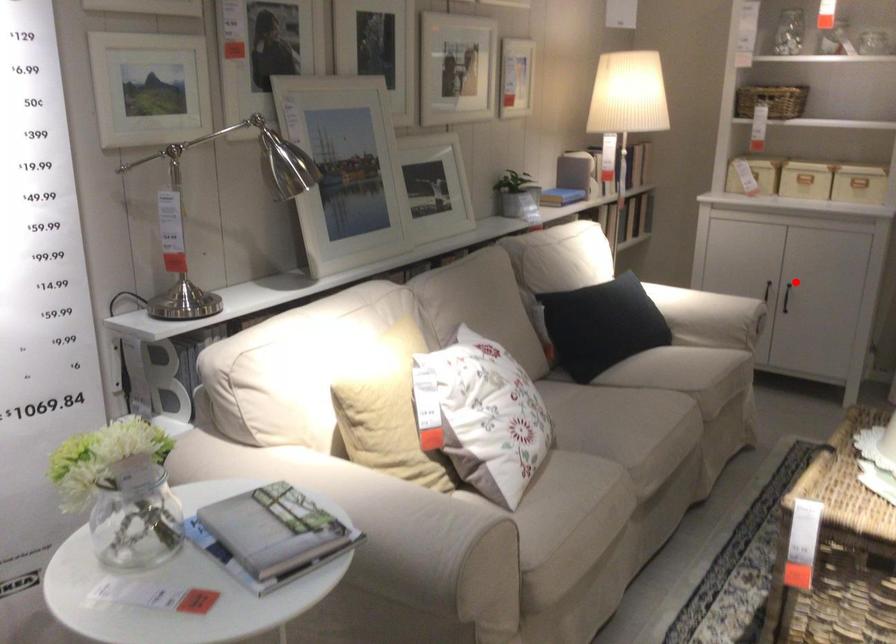
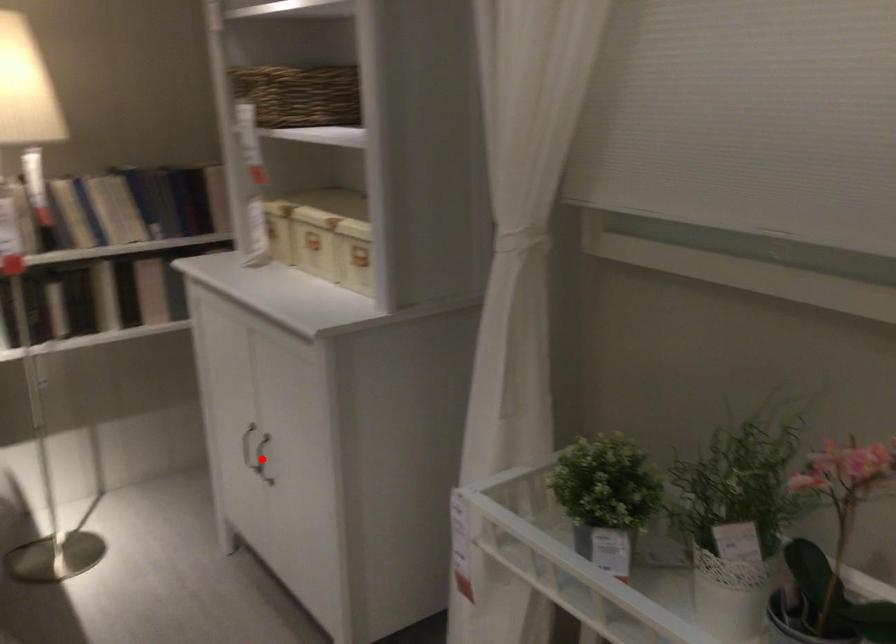
I am providing you with two images of the same scene from different viewpoints. A red point is marked on the first image and another point is marked on the second image. Is the marked point in image1 the same physical position as the marked point in image2?

Yes